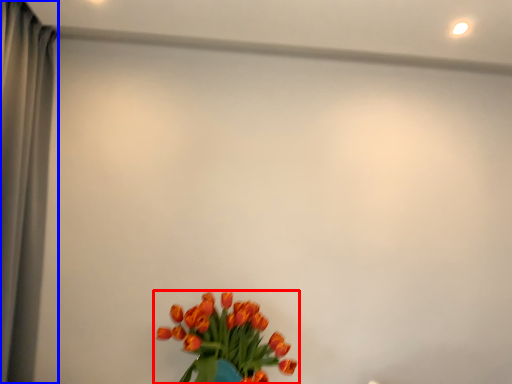
Question: Among these objects, which one is nearest to the camera, flower (highlighted by a red box) or curtain (highlighted by a blue box)?

Choices:
 (A) flower
 (B) curtain

Answer: (B)